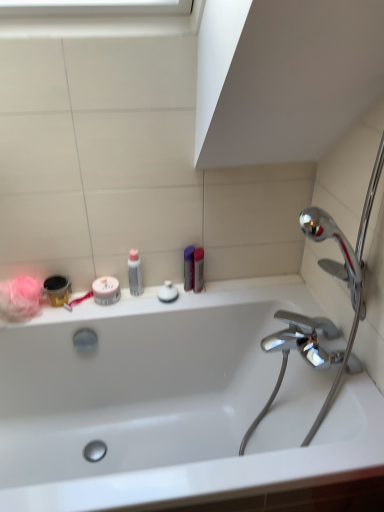
Identify the location of vacant area to the right of white glossy soap at center, placed as the 2th toiletry when sorted from left to right. The width and height of the screenshot is (384, 512). (209, 297).